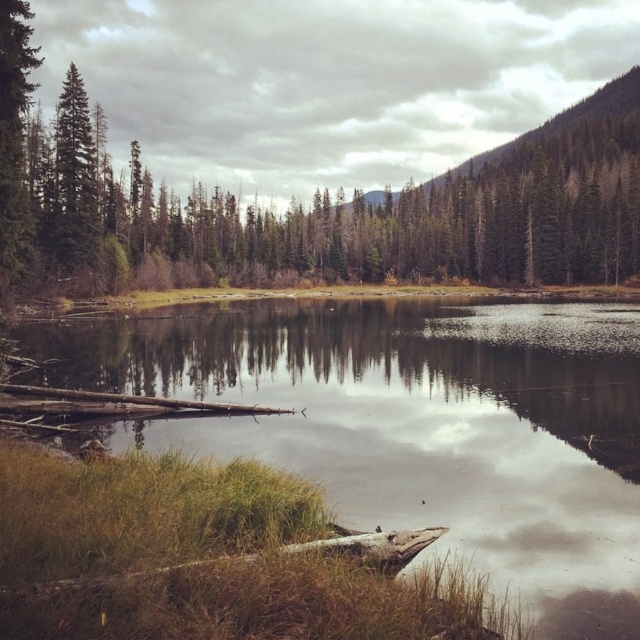
Does smooth reflective water at center have a larger size compared to green matte tree at center?

No.

Consider the image. Is smooth reflective water at center smaller than green matte tree at center?

Correct, smooth reflective water at center occupies less space than green matte tree at center.

What do you see at coordinates (412, 424) in the screenshot? I see `smooth reflective water at center` at bounding box center [412, 424].

Locate an element on the screen. The height and width of the screenshot is (640, 640). smooth reflective water at center is located at coordinates (412, 424).